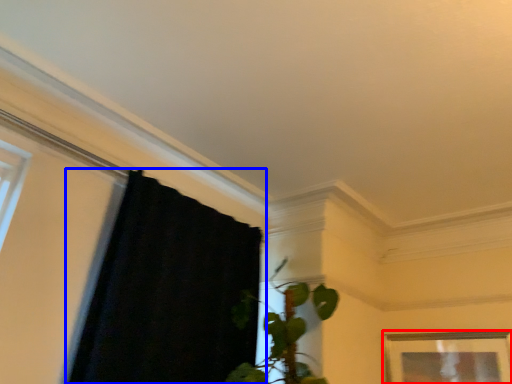
Question: Which point is closer to the camera, picture frame (highlighted by a red box) or curtain (highlighted by a blue box)?

Choices:
 (A) picture frame
 (B) curtain

Answer: (B)